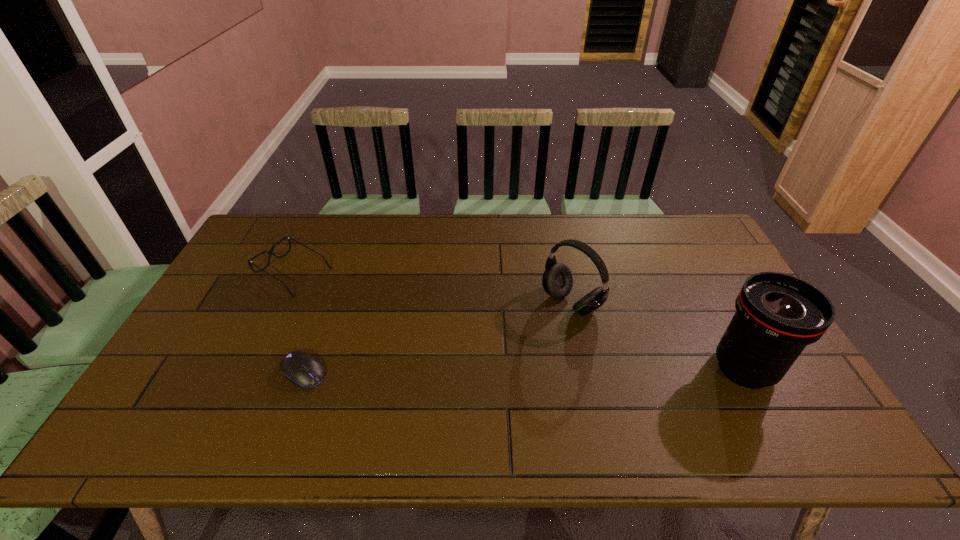
Find the location of a particular element. vacant spot on the desktop that is between the shortest object and the telephoto lens and is positioned with the lenses facing outward on the spectacles is located at coordinates [481, 371].

Identify the location of vacant spot on the desktop that is between the computer mouse and the rightmost object and is positioned on the ear cups of the second object from right to left. (483, 371).